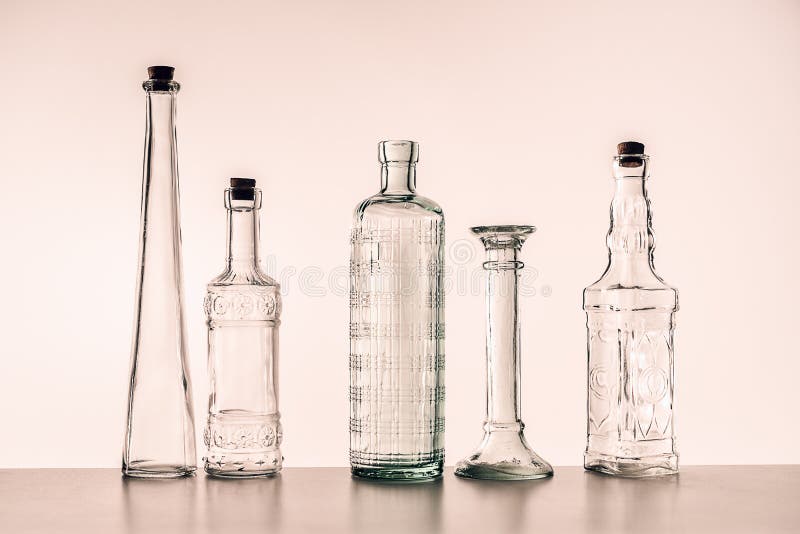
Image resolution: width=800 pixels, height=534 pixels. Find the location of `table`. table is located at coordinates (440, 512).